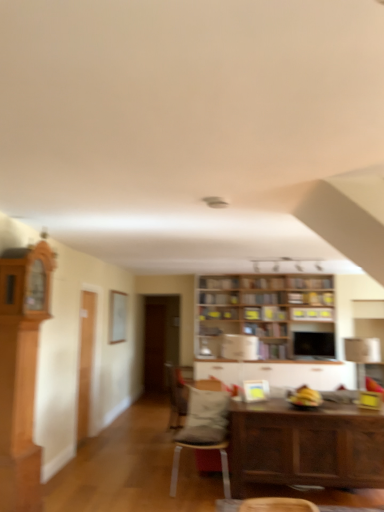
Question: Do you think velvet gray chair at center, the first chair positioned from the back, is within light brown wood cabinet at left, acting as the first cabinetry starting from the front, or outside of it?

Choices:
 (A) outside
 (B) inside

Answer: (A)

Question: From their relative heights in the image, would you say velvet gray chair at center, placed as the second chair when sorted from front to back, is taller or shorter than light brown wood cabinet at left, the second cabinetry from the right?

Choices:
 (A) tall
 (B) short

Answer: (B)

Question: Based on their relative distances, which object is nearer to the matte gray cushioned chair at center, which is the 1th chair in front-to-back order?

Choices:
 (A) wooden table at lower right
 (B) velvet gray chair at center, the first chair positioned from the back
 (C) light brown wood cabinet at left, acting as the first cabinetry starting from the front
 (D) white glossy cabinet at center, which is counted as the second cabinetry, starting from the top
 (E) wooden bookshelf at center, which is the second shelf in bottom-to-top order

Answer: (B)

Question: Which is farther from the wooden bookshelf at center, which is the second shelf in bottom-to-top order?

Choices:
 (A) velvet gray chair at center, placed as the second chair when sorted from front to back
 (B) matte gray cushioned chair at center, the second chair when ordered from back to front
 (C) wooden shelves at upper center, which is the third shelf in bottom-to-top order
 (D) wooden bookshelf at center, the 4th shelf when ordered from bottom to top
 (E) white glossy cabinet at center, positioned as the first cabinetry in bottom-to-top order

Answer: (B)